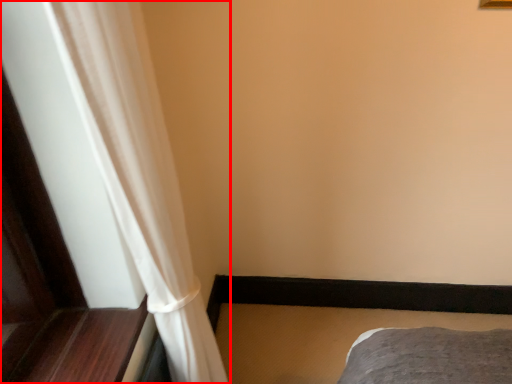
Question: Where is curtain (annotated by the red box) located in relation to bed frame in the image?

Choices:
 (A) left
 (B) right

Answer: (A)